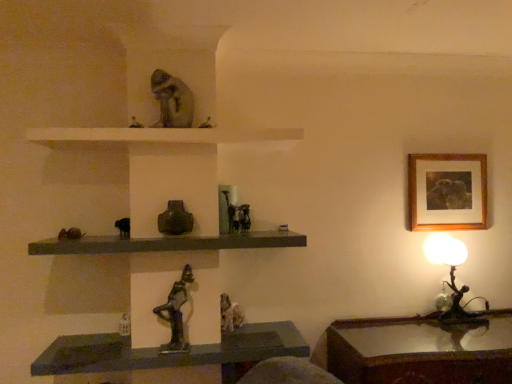
Find the location of a particular element. The image size is (512, 384). free spot below matte stone chameleon at upper center, which appears as the 4th animal when ordered from the bottom (from a real-world perspective) is located at coordinates (173, 128).